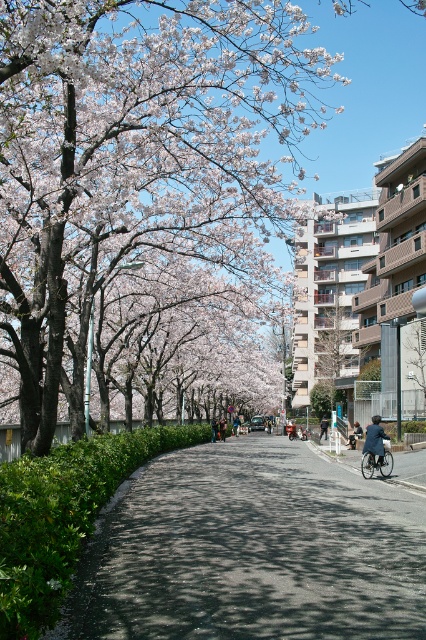
Locate an element on the screen. green leafy hedge at lower left is located at coordinates (250, 552).

Which of these two, green leafy hedge at lower left or green fabric jacket at center, stands taller?

With more height is green leafy hedge at lower left.

Who is more distant from viewer, (417,513) or (224,422)?

Positioned behind is point (224,422).

You are a GUI agent. You are given a task and a screenshot of the screen. Output one action in this format:
    pyautogui.click(x=<x>, y=<y>)
    Task: Click on the green leafy hedge at lower left
    This screenshot has height=640, width=426.
    Given the screenshot: What is the action you would take?
    pyautogui.click(x=250, y=552)

Does green fabric jacket at center have a greater height compared to denim jacket at center?

Yes.

Is green fabric jacket at center to the right of denim jacket at center from the viewer's perspective?

No, green fabric jacket at center is not to the right of denim jacket at center.

Where is `green fabric jacket at center`? The height and width of the screenshot is (640, 426). green fabric jacket at center is located at coordinates (221, 428).

Where is `green fabric jacket at center`? Image resolution: width=426 pixels, height=640 pixels. green fabric jacket at center is located at coordinates (221, 428).

Which is more to the right, smooth pink blossoms at center or metallic silver bicycle at center?

metallic silver bicycle at center

At what (x,y) coordinates should I click in order to perform the action: click on smooth pink blossoms at center. Please return your answer as a coordinate pair (x, y). The image size is (426, 640). Looking at the image, I should click on (138, 168).

Between point (13, 156) and point (373, 460), which one is positioned behind?

The point (373, 460) is behind.

This screenshot has height=640, width=426. Find the location of `smooth pink blossoms at center`. smooth pink blossoms at center is located at coordinates (138, 168).